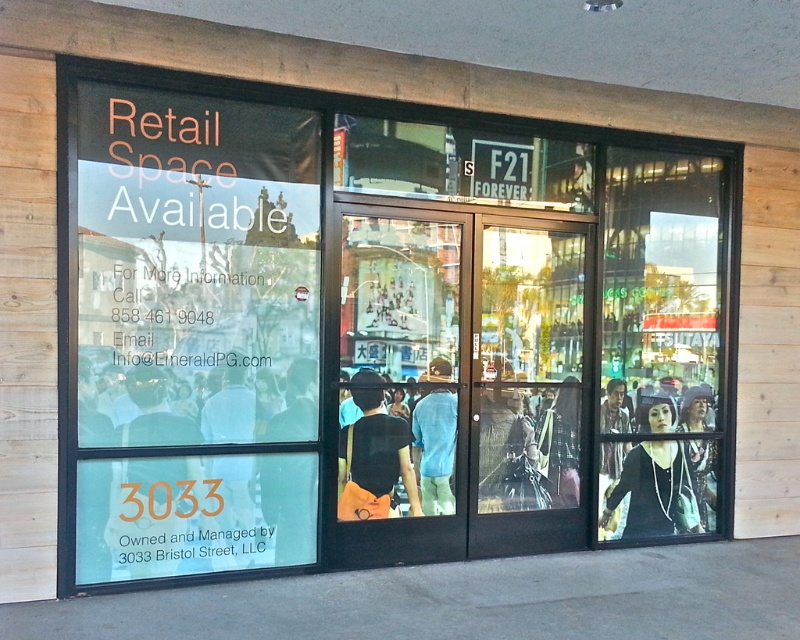
Is transparent glass doors at center wider than matte black jacket at right?

Yes, transparent glass doors at center is wider than matte black jacket at right.

Does point (393, 483) come in front of point (694, 497)?

Yes, point (393, 483) is in front of point (694, 497).

Who is more forward, (444, 472) or (682, 467)?

Point (444, 472) is in front.

At what (x,y) coordinates should I click in order to perform the action: click on transparent glass doors at center. Please return your answer as a coordinate pair (x, y). The height and width of the screenshot is (640, 800). Looking at the image, I should click on (464, 381).

Is matte black jacket at right taller than blue cotton shirt at center?

Incorrect, matte black jacket at right's height is not larger of blue cotton shirt at center's.

Is matte black jacket at right behind blue cotton shirt at center?

Yes, it is.

Between point (654, 496) and point (448, 493), which one is positioned behind?

The point (654, 496) is behind.

Where is `matte black jacket at right`? The width and height of the screenshot is (800, 640). matte black jacket at right is located at coordinates (654, 492).

Does matte black jacket at right have a smaller size compared to black matte shirt at center?

Actually, matte black jacket at right might be larger than black matte shirt at center.

Which of these two, matte black jacket at right or black matte shirt at center, stands taller?

matte black jacket at right is taller.

Is point (632, 484) closer to viewer compared to point (376, 502)?

No, (632, 484) is behind (376, 502).

I want to click on matte black jacket at right, so click(x=654, y=492).